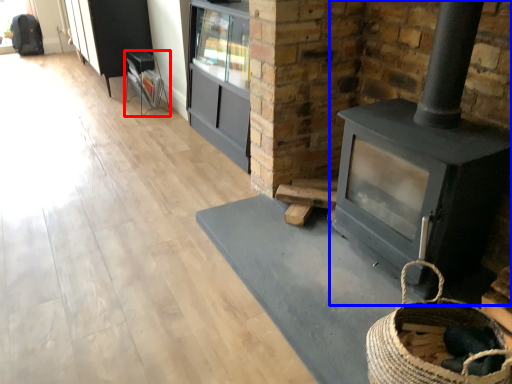
Question: Which of the following is the farthest to the observer, furniture (highlighted by a red box) or wood burning stove (highlighted by a blue box)?

Choices:
 (A) furniture
 (B) wood burning stove

Answer: (A)